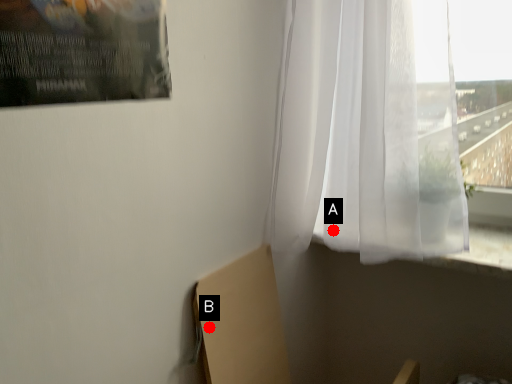
Question: Two points are circled on the image, labeled by A and B beside each circle. Which point appears closest to the camera in this image?

Choices:
 (A) A is closer
 (B) B is closer

Answer: (B)